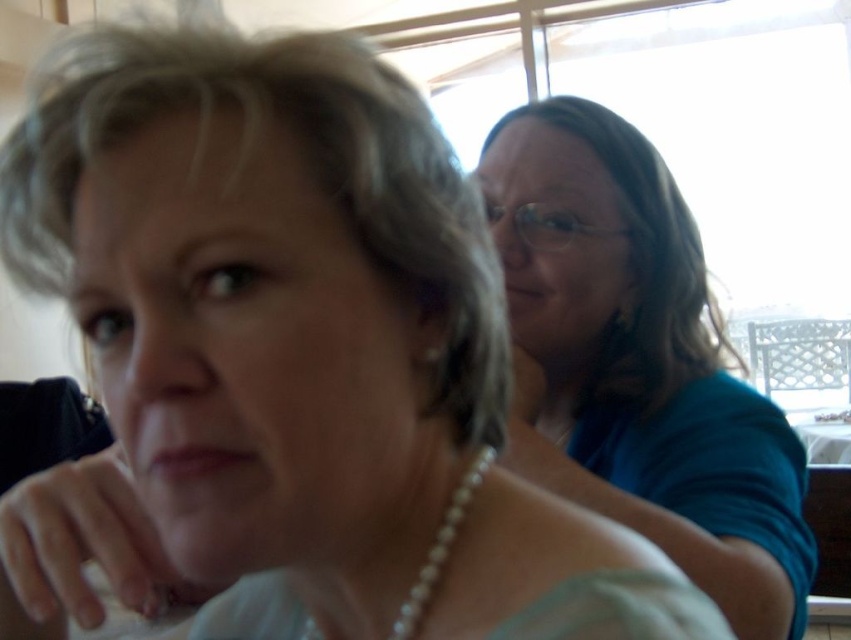
You are an interior designer assessing the spatial arrangement of the room. The blue fabric shirt at upper right and pearl necklace at center are both visible in the frame. Which object occupies more space in the image?

The blue fabric shirt at upper right is larger in size than the pearl necklace at center, so it occupies more space in the image.